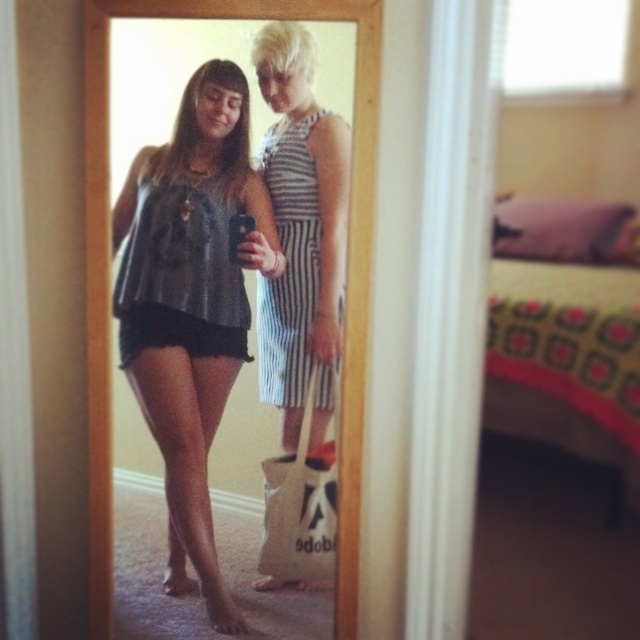
Which of these two, matte gray tank top at center or striped fabric dress at center, stands shorter?

Standing shorter between the two is striped fabric dress at center.

Between matte gray tank top at center and striped fabric dress at center, which one appears on the right side from the viewer's perspective?

Positioned to the right is striped fabric dress at center.

Between point (248, 112) and point (257, 317), which one is positioned behind?

Positioned behind is point (257, 317).

You are a GUI agent. You are given a task and a screenshot of the screen. Output one action in this format:
    pyautogui.click(x=<x>, y=<y>)
    Task: Click on the matte gray tank top at center
    
    Given the screenshot: What is the action you would take?
    (192, 301)